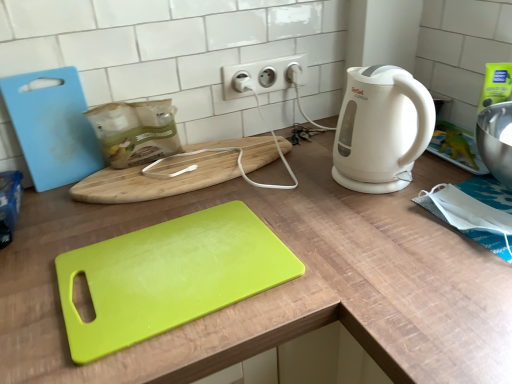
Locate an element on the screen. Image resolution: width=512 pixels, height=384 pixels. vacant space situated above wooden cutting board at center, marked as the 3th cutting board in a front-to-back arrangement (from a real-world perspective) is located at coordinates (187, 162).